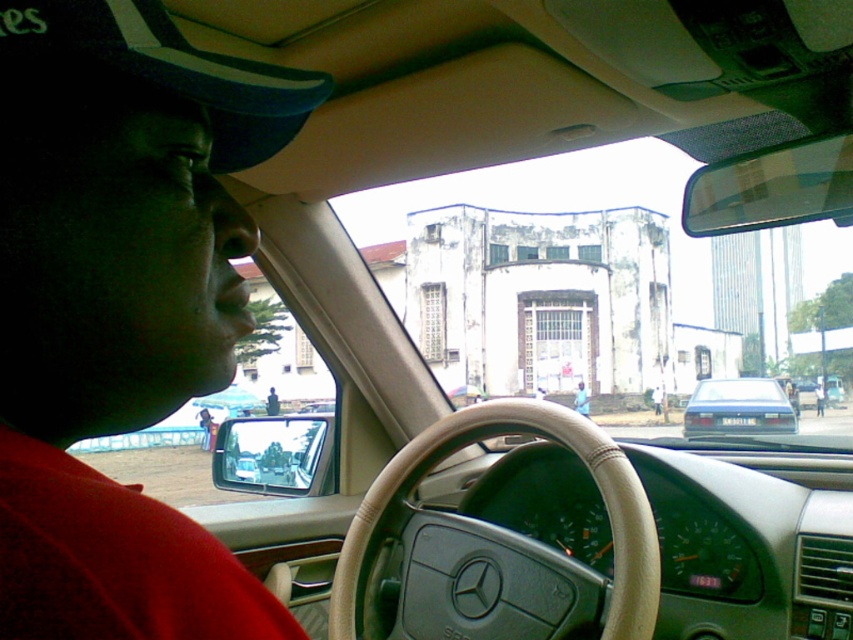
Does matte red shirt at left appear under light blue fabric shirt at center?

No, matte red shirt at left is not below light blue fabric shirt at center.

In the scene shown: Can you confirm if matte red shirt at left is positioned to the right of light blue fabric shirt at center?

In fact, matte red shirt at left is to the left of light blue fabric shirt at center.

This screenshot has height=640, width=853. I want to click on matte red shirt at left, so click(120, 307).

Locate an element on the screen. matte red shirt at left is located at coordinates coord(120,307).

Who is positioned more to the left, beige leather steering wheel at center or matte black sedan at center?

beige leather steering wheel at center

Does beige leather steering wheel at center have a smaller size compared to matte black sedan at center?

Correct, beige leather steering wheel at center occupies less space than matte black sedan at center.

The image size is (853, 640). I want to click on beige leather steering wheel at center, so click(x=498, y=545).

Where is `beige leather steering wheel at center`? beige leather steering wheel at center is located at coordinates (498, 545).

Is the position of dark blue fabric baseball cap at upper left more distant than that of light blue fabric shirt at center?

No, dark blue fabric baseball cap at upper left is closer to the viewer.

Can you confirm if dark blue fabric baseball cap at upper left is thinner than light blue fabric shirt at center?

Incorrect, dark blue fabric baseball cap at upper left's width is not less than light blue fabric shirt at center's.

I want to click on dark blue fabric baseball cap at upper left, so pyautogui.click(x=166, y=68).